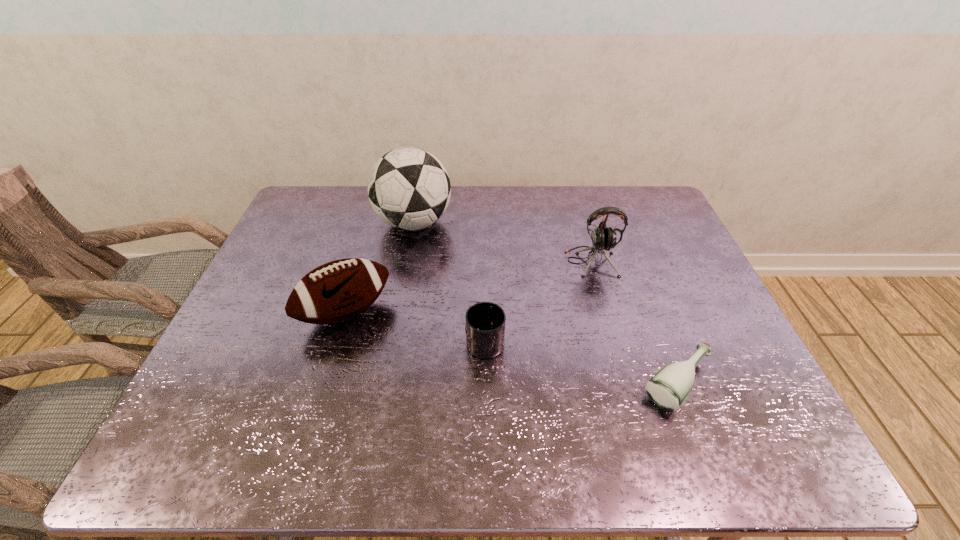
Locate an element on the screen. The image size is (960, 540). free spot between the fourth shortest object and the third shortest object is located at coordinates (468, 287).

At what (x,y) coordinates should I click in order to perform the action: click on free space between the football (American) and the fourth shortest object. Please return your answer as a coordinate pair (x, y). This screenshot has height=540, width=960. Looking at the image, I should click on (468, 287).

Find the location of a particular element. empty space between the football (American) and the earphone is located at coordinates (468, 287).

Identify the location of free spot between the bottle and the fourth tallest object. (582, 362).

Locate an element on the screen. free point between the fourth tallest object and the tallest object is located at coordinates point(449,281).

Where is `free spot between the fourth shortest object and the bottle`? This screenshot has width=960, height=540. free spot between the fourth shortest object and the bottle is located at coordinates point(635,323).

Where is `free space between the second tallest object and the bottle`? free space between the second tallest object and the bottle is located at coordinates (635, 323).

Image resolution: width=960 pixels, height=540 pixels. What are the coordinates of `vacant point located between the mug and the football (American)` in the screenshot? It's located at (416, 326).

Choose which object is the second nearest neighbor to the football (American). Please provide its 2D coordinates. Your answer should be formatted as a tuple, i.e. [(x, y)], where the tuple contains the x and y coordinates of a point satisfying the conditions above.

[(485, 321)]

Locate an element on the screen. The width and height of the screenshot is (960, 540). object that is the fourth nearest to the shortest object is located at coordinates (409, 188).